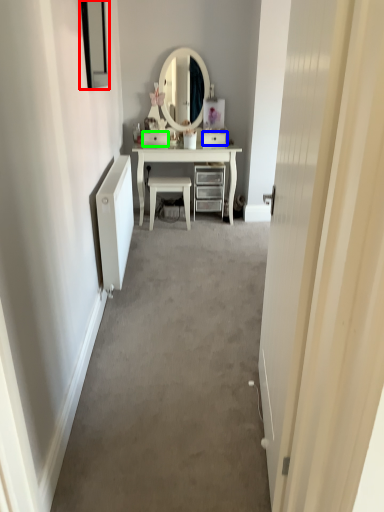
Question: Which object is positioned farthest from picture frame (highlighted by a red box)? Select from drawer (highlighted by a blue box) and drawer (highlighted by a green box).

Choices:
 (A) drawer
 (B) drawer

Answer: (A)